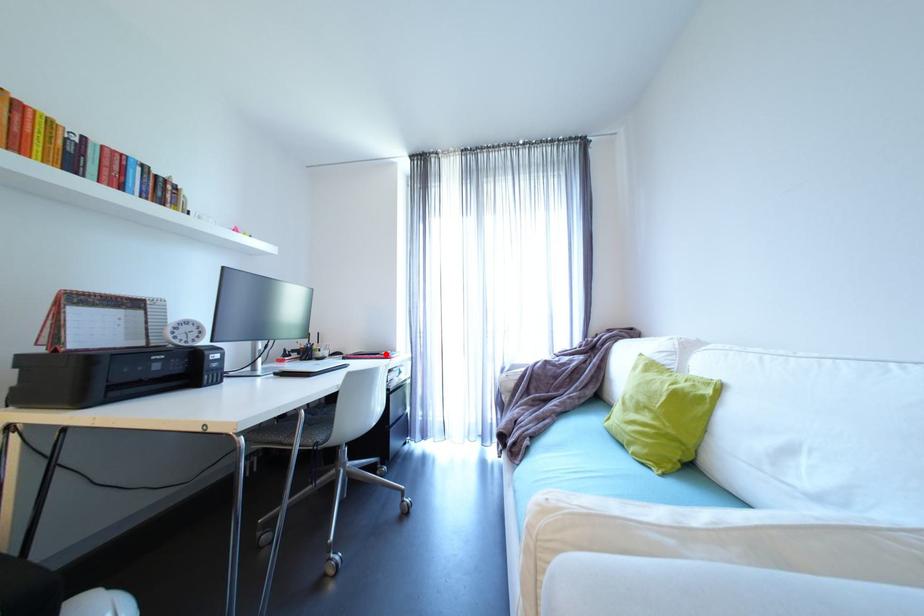
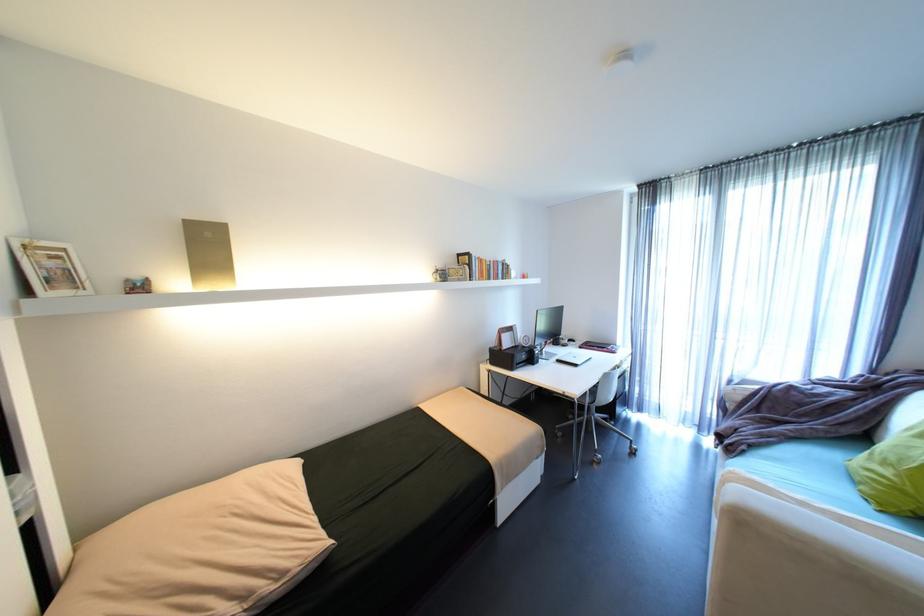
Where in the second image is the point corresponding to the highlighted location from the first image?

(612, 347)